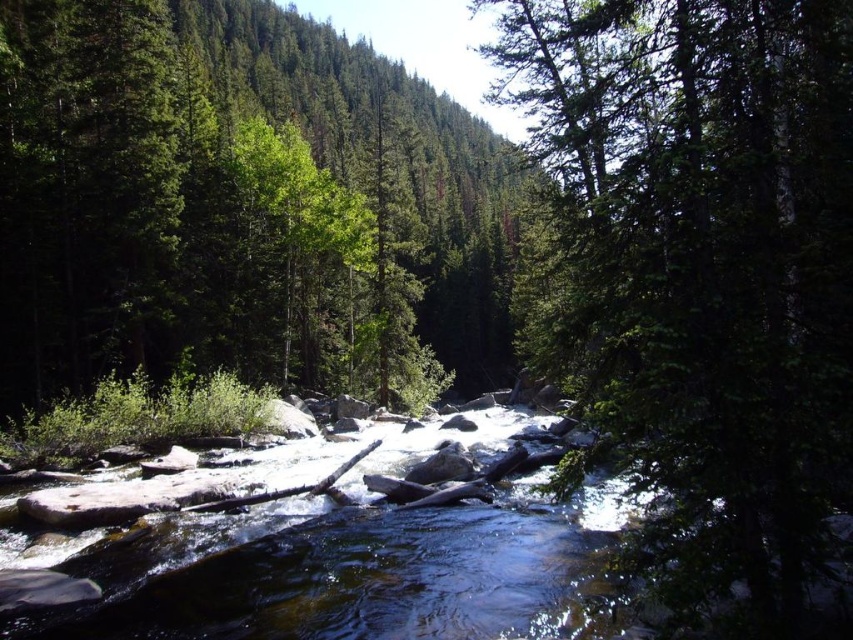
Question: Is green textured tree at center above green matte tree at upper center?

Choices:
 (A) no
 (B) yes

Answer: (A)

Question: Observing the image, what is the correct spatial positioning of green textured tree at center in reference to green matte tree at upper center?

Choices:
 (A) left
 (B) right

Answer: (B)

Question: Which point appears farthest from the camera in this image?

Choices:
 (A) (740, 472)
 (B) (79, 355)

Answer: (B)

Question: Is green textured tree at center further to camera compared to green matte tree at upper center?

Choices:
 (A) yes
 (B) no

Answer: (B)

Question: Which point is farther from the camera taking this photo?

Choices:
 (A) (714, 433)
 (B) (352, 196)

Answer: (B)

Question: Among these points, which one is nearest to the camera?

Choices:
 (A) coord(254,141)
 (B) coord(793,588)

Answer: (B)